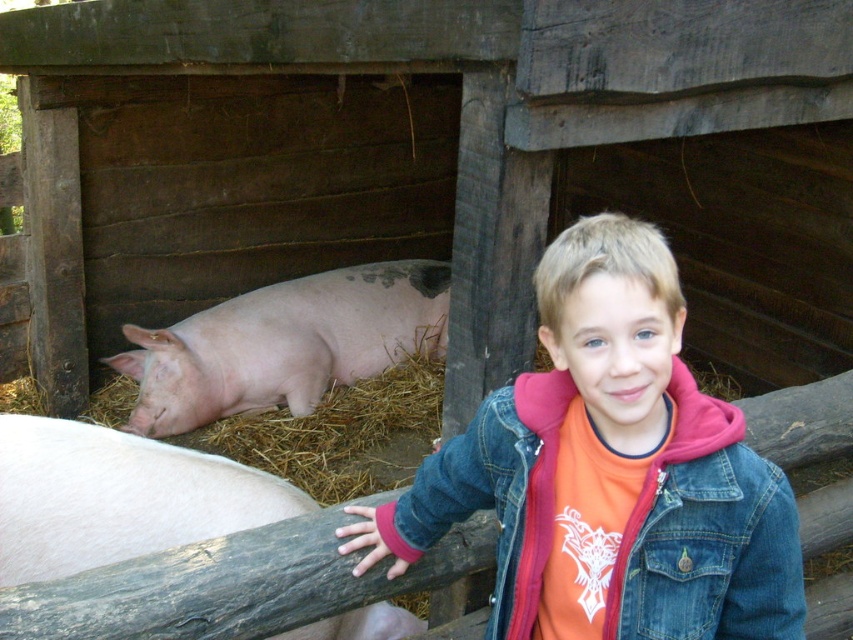
Question: Does pink smooth skin at left have a lesser width compared to pink matte/skinny pig at left?

Choices:
 (A) no
 (B) yes

Answer: (B)

Question: Which object is farther from the camera taking this photo?

Choices:
 (A) pink matte/skinny pig at left
 (B) pink smooth skin at left
 (C) denim jacket at lower right

Answer: (A)

Question: Is pink smooth skin at left bigger than pink matte/skinny pig at left?

Choices:
 (A) yes
 (B) no

Answer: (B)

Question: Which of the following is the closest to the observer?

Choices:
 (A) (381, 352)
 (B) (654, 618)
 (C) (170, 496)

Answer: (B)

Question: Is denim jacket at lower right positioned behind pink matte/skinny pig at left?

Choices:
 (A) yes
 (B) no

Answer: (B)

Question: Which is farther from the pink matte/skinny pig at left?

Choices:
 (A) denim jacket at lower right
 (B) pink smooth skin at left

Answer: (A)